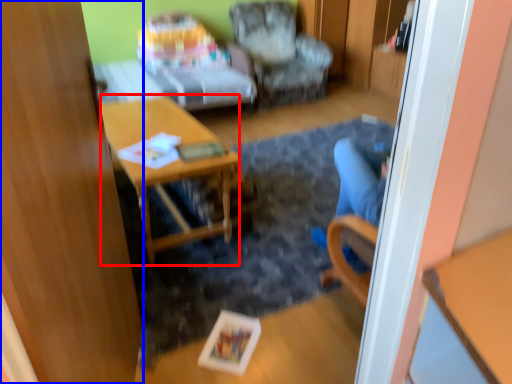
Question: Which of the following is the farthest to the observer, desk (highlighted by a red box) or glass door (highlighted by a blue box)?

Choices:
 (A) desk
 (B) glass door

Answer: (A)